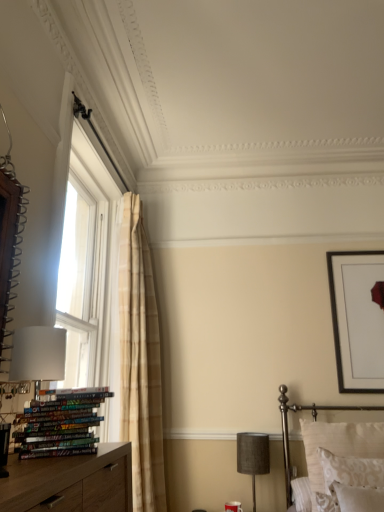
Question: Is patterned fabric pillow at lower right facing towards white matte table lamp at left, the 1th table lamp from the front?

Choices:
 (A) no
 (B) yes

Answer: (A)

Question: Would you consider patterned fabric pillow at lower right to be distant from white matte table lamp at left, the 1th table lamp from the left?

Choices:
 (A) yes
 (B) no

Answer: (A)

Question: Would you say patterned fabric pillow at lower right contains white matte table lamp at left, acting as the 1th table lamp starting from the top?

Choices:
 (A) no
 (B) yes

Answer: (A)

Question: Is patterned fabric pillow at lower right thinner than white matte table lamp at left, acting as the 1th table lamp starting from the top?

Choices:
 (A) yes
 (B) no

Answer: (B)

Question: Can you confirm if patterned fabric pillow at lower right is bigger than white matte table lamp at left, which ranks as the second table lamp in bottom-to-top order?

Choices:
 (A) no
 (B) yes

Answer: (B)

Question: Is patterned fabric pillow at lower right wider or thinner than multicolored glossy books at lower left?

Choices:
 (A) wide
 (B) thin

Answer: (B)

Question: Looking at the image, does patterned fabric pillow at lower right seem bigger or smaller compared to multicolored glossy books at lower left?

Choices:
 (A) big
 (B) small

Answer: (A)

Question: From the image's perspective, is patterned fabric pillow at lower right located above or below multicolored glossy books at lower left?

Choices:
 (A) below
 (B) above

Answer: (A)

Question: Which is correct: patterned fabric pillow at lower right is inside multicolored glossy books at lower left, or outside of it?

Choices:
 (A) outside
 (B) inside

Answer: (A)

Question: Looking at their shapes, would you say white matte table lamp at left, marked as the 2th table lamp in a right-to-left arrangement, is wider or thinner than textured gray lampshade at lower right, which is the 1th table lamp in bottom-to-top order?

Choices:
 (A) thin
 (B) wide

Answer: (A)

Question: Do you think white matte table lamp at left, which ranks as the second table lamp in bottom-to-top order, is within textured gray lampshade at lower right, arranged as the 2th table lamp when viewed from the top, or outside of it?

Choices:
 (A) outside
 (B) inside

Answer: (A)

Question: From their relative heights in the image, would you say white matte table lamp at left, the 1th table lamp from the front, is taller or shorter than textured gray lampshade at lower right, placed as the second table lamp when sorted from front to back?

Choices:
 (A) tall
 (B) short

Answer: (B)

Question: Is white matte table lamp at left, the 1th table lamp from the front, in front of or behind textured gray lampshade at lower right, which is the 1th table lamp in bottom-to-top order, in the image?

Choices:
 (A) front
 (B) behind

Answer: (A)

Question: Would you say black matte picture frame at upper right is to the left or to the right of multicolored glossy books at lower left in the picture?

Choices:
 (A) right
 (B) left

Answer: (A)

Question: Is point (354, 293) closer or farther from the camera than point (72, 448)?

Choices:
 (A) closer
 (B) farther

Answer: (B)